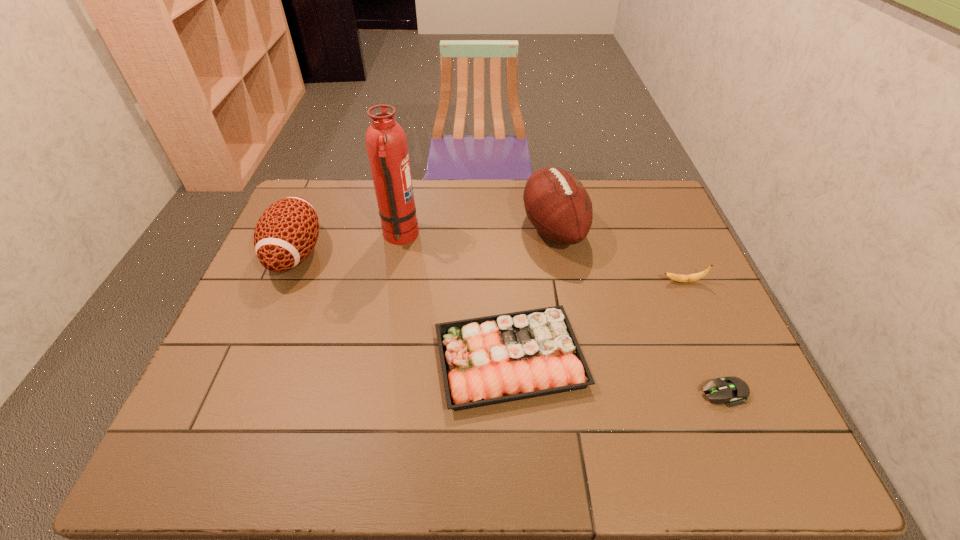
The width and height of the screenshot is (960, 540). Identify the location of free space between the fifth shortest object and the third shortest object. point(618,255).

Where is `unoccupied area between the second shortest object and the shorter football`? Image resolution: width=960 pixels, height=540 pixels. unoccupied area between the second shortest object and the shorter football is located at coordinates (403, 306).

This screenshot has width=960, height=540. Find the location of `vacant space that's between the second object from left to right and the fourth shortest object`. vacant space that's between the second object from left to right and the fourth shortest object is located at coordinates (348, 245).

Find the location of a particular element. This screenshot has width=960, height=540. free space between the taller football and the banana is located at coordinates (618, 255).

Locate an element on the screen. This screenshot has height=540, width=960. vacant area between the left football and the second tallest object is located at coordinates (424, 241).

Where is `blank region between the platter and the fifth shortest object`? The height and width of the screenshot is (540, 960). blank region between the platter and the fifth shortest object is located at coordinates (532, 294).

Where is `blank region between the fourth shortest object and the fifth shortest object`? The image size is (960, 540). blank region between the fourth shortest object and the fifth shortest object is located at coordinates (424, 241).

The image size is (960, 540). What are the coordinates of `free area in between the leftmost object and the banana` in the screenshot? It's located at (490, 267).

Locate an element on the screen. The image size is (960, 540). vacant space in between the banana and the platter is located at coordinates pos(596,320).

Image resolution: width=960 pixels, height=540 pixels. I want to click on the closest object to the taller football, so click(x=488, y=360).